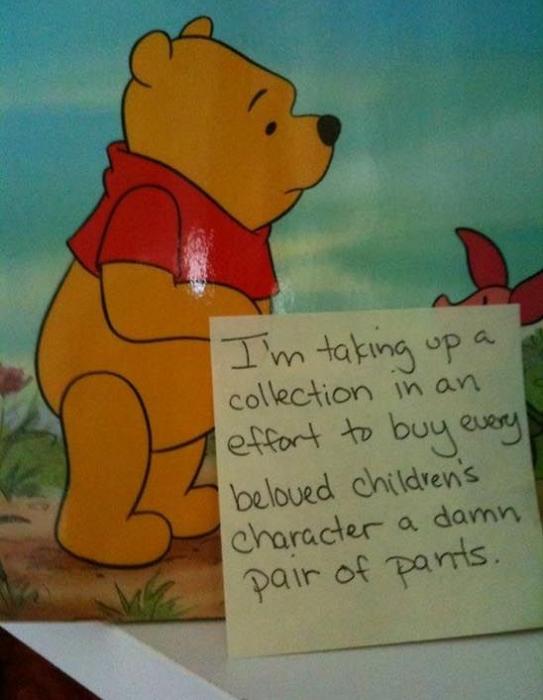
I want to click on notepaper, so click(331, 455).